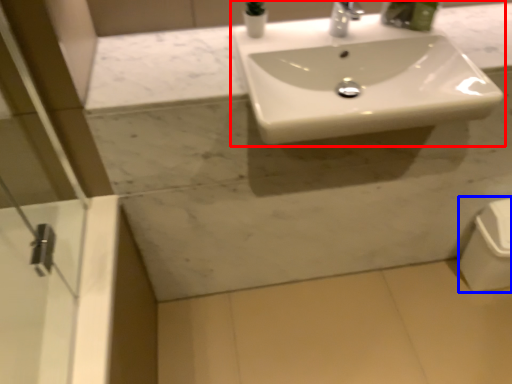
Question: Which object appears farthest to the camera in this image, sink (highlighted by a red box) or porcelain (highlighted by a blue box)?

Choices:
 (A) sink
 (B) porcelain

Answer: (B)